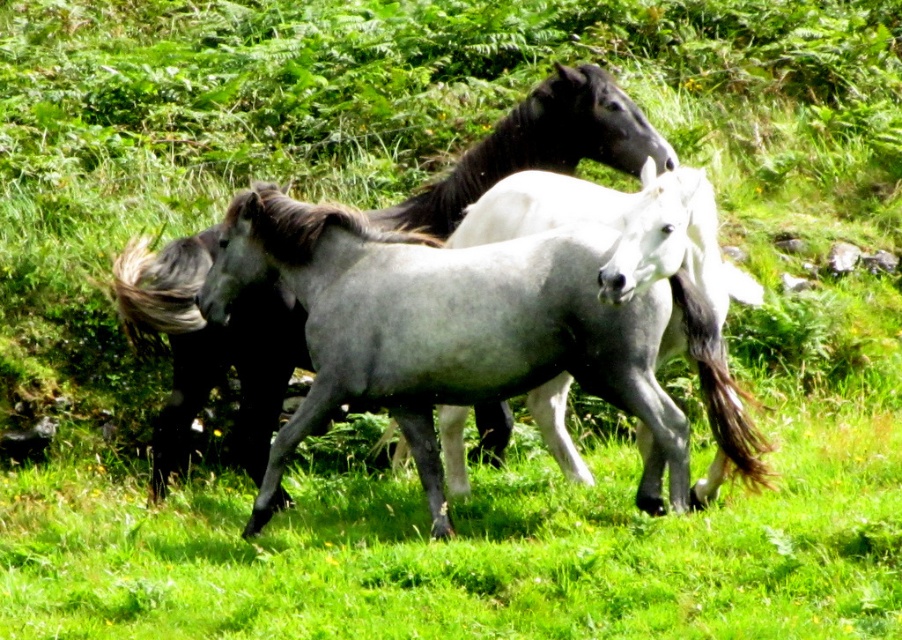
Which of these two, gray glossy horse at center or white glossy horse at center, stands shorter?

gray glossy horse at center

Is point (164, 451) less distant than point (704, 280)?

That is False.

Identify the location of gray glossy horse at center. The width and height of the screenshot is (902, 640). (207, 349).